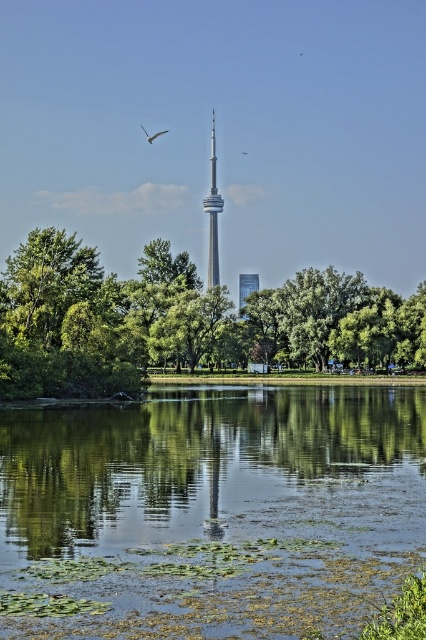
You are a park visitor who wants to take a photo of the white glossy bird at upper center and the white feathered bird at upper center in the same frame. Can you fit both birds into your camera viewfinder if your camera has a maximum field of view of 100 feet?

The white glossy bird at upper center and the white feathered bird at upper center are 102.66 feet apart, which exceeds the camera viewfinder maximum field of view of 100 feet. Therefore, you cannot fit both birds into the same frame.